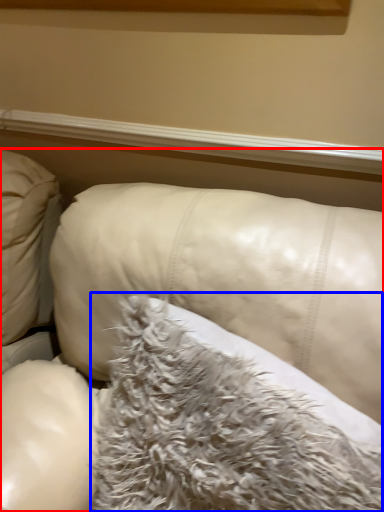
Question: Which of the following is the farthest to the observer, furniture (highlighted by a red box) or pillow (highlighted by a blue box)?

Choices:
 (A) furniture
 (B) pillow

Answer: (B)